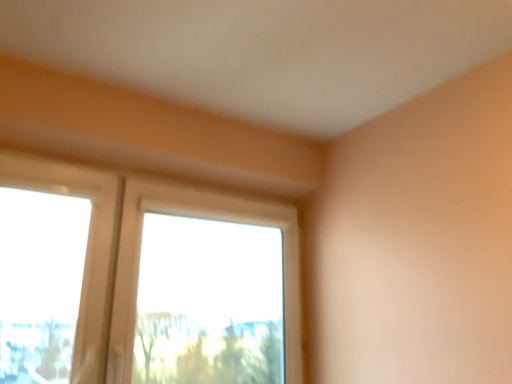
In order to click on clear glass window at center in this screenshot , I will do `click(139, 254)`.

What do you see at coordinates (139, 254) in the screenshot? I see `clear glass window at center` at bounding box center [139, 254].

This screenshot has width=512, height=384. What do you see at coordinates (40, 283) in the screenshot?
I see `transparent plastic window screen at left` at bounding box center [40, 283].

You are a GUI agent. You are given a task and a screenshot of the screen. Output one action in this format:
    pyautogui.click(x=<x>, y=<y>)
    Task: Click on the transparent plastic window screen at left
    This screenshot has height=384, width=512.
    Given the screenshot: What is the action you would take?
    pyautogui.click(x=40, y=283)

In order to face transparent plastic window screen at left, should I rotate leftwards or rightwards?

To face it directly, rotate left by 25.400 degrees.

The height and width of the screenshot is (384, 512). Find the location of `clear glass window at center`. clear glass window at center is located at coordinates (139, 254).

Is transparent plastic window screen at left at the right side of clear glass window at center?

In fact, transparent plastic window screen at left is to the left of clear glass window at center.

Is the position of transparent plastic window screen at left less distant than that of clear glass window at center?

Yes.

Does point (36, 375) appear closer or farther from the camera than point (112, 349)?

Clearly, point (36, 375) is closer to the camera than point (112, 349).

From the image's perspective, between transparent plastic window screen at left and clear glass window at center, who is located below?

clear glass window at center.

From a real-world perspective, is transparent plastic window screen at left positioned above or below clear glass window at center?

From a real-world perspective, transparent plastic window screen at left is physically above clear glass window at center.

Which object is wider, transparent plastic window screen at left or clear glass window at center?

With larger width is clear glass window at center.

Considering the sizes of objects transparent plastic window screen at left and clear glass window at center in the image provided, who is taller, transparent plastic window screen at left or clear glass window at center?

Standing taller between the two is clear glass window at center.

Which of these two, transparent plastic window screen at left or clear glass window at center, is smaller?

transparent plastic window screen at left is smaller.

Does transparent plastic window screen at left contain clear glass window at center?

No, clear glass window at center is located outside of transparent plastic window screen at left.

Is transparent plastic window screen at left far from clear glass window at center?

Actually, transparent plastic window screen at left and clear glass window at center are a little close together.

Is transparent plastic window screen at left positioned with its back to clear glass window at center?

That's not correct — transparent plastic window screen at left is not looking away from clear glass window at center.

Can you tell me how much transparent plastic window screen at left and clear glass window at center differ in facing direction?

The facing directions of transparent plastic window screen at left and clear glass window at center are 0.00176 degrees apart.

How much distance is there between transparent plastic window screen at left and clear glass window at center?

transparent plastic window screen at left and clear glass window at center are 6.78 inches apart from each other.

The image size is (512, 384). Identify the location of window screen in front of the clear glass window at center. (40, 283).

Based on their positions, is clear glass window at center located to the left or right of transparent plastic window screen at left?

Clearly, clear glass window at center is on the right of transparent plastic window screen at left in the image.

Is the depth of clear glass window at center less than that of transparent plastic window screen at left?

No, it is behind transparent plastic window screen at left.

Is point (96, 213) positioned behind point (10, 327)?

Yes, point (96, 213) is behind point (10, 327).

From the image's perspective, does clear glass window at center appear lower than transparent plastic window screen at left?

Yes.

Looking at this image, from a real-world perspective, is clear glass window at center positioned above or below transparent plastic window screen at left?

From a real-world perspective, clear glass window at center is physically below transparent plastic window screen at left.

Can you confirm if clear glass window at center is wider than transparent plastic window screen at left?

Yes.

Does clear glass window at center have a greater height compared to transparent plastic window screen at left?

Indeed, clear glass window at center has a greater height compared to transparent plastic window screen at left.

Is clear glass window at center bigger than transparent plastic window screen at left?

Correct, clear glass window at center is larger in size than transparent plastic window screen at left.

Can we say clear glass window at center lies outside transparent plastic window screen at left?

clear glass window at center lies outside transparent plastic window screen at left's area.

Does clear glass window at center touch transparent plastic window screen at left?

clear glass window at center is not next to transparent plastic window screen at left, and they're not touching.

Does clear glass window at center turn towards transparent plastic window screen at left?

No, clear glass window at center is not aimed at transparent plastic window screen at left.

Locate an element on the screen. This screenshot has width=512, height=384. window screen that appears on the left of clear glass window at center is located at coordinates (40, 283).

Image resolution: width=512 pixels, height=384 pixels. In order to click on window screen above the clear glass window at center (from the image's perspective) in this screenshot , I will do `click(40, 283)`.

The width and height of the screenshot is (512, 384). I want to click on window beneath the transparent plastic window screen at left (from a real-world perspective), so 139,254.